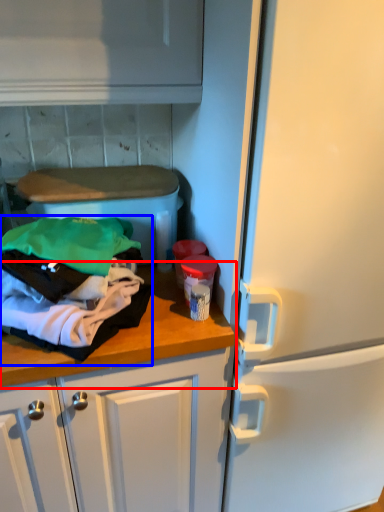
Question: Which point is further to the camera, countertop (highlighted by a red box) or clothing (highlighted by a blue box)?

Choices:
 (A) countertop
 (B) clothing

Answer: (A)